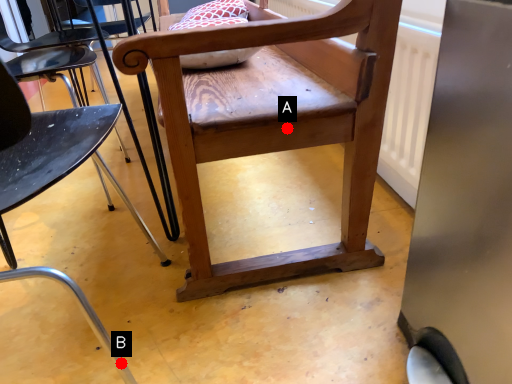
Question: Two points are circled on the image, labeled by A and B beside each circle. Which point appears closest to the camera in this image?

Choices:
 (A) A is closer
 (B) B is closer

Answer: (B)